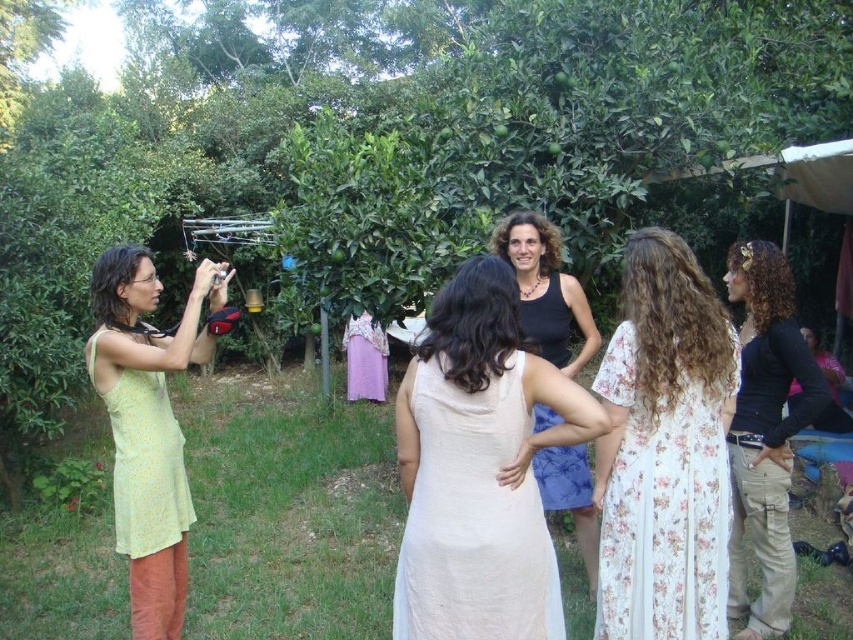
Is black matte pants at right above light beige fabric dress at center?

Yes.

What do you see at coordinates (764, 433) in the screenshot? I see `black matte pants at right` at bounding box center [764, 433].

Which is behind, point (729, 289) or point (589, 477)?

The point (589, 477) is behind.

The height and width of the screenshot is (640, 853). What are the coordinates of `black matte pants at right` in the screenshot? It's located at (764, 433).

Is white cotton dress at center shorter than yellow floral fabric dress at left?

Incorrect, white cotton dress at center's height does not fall short of yellow floral fabric dress at left's.

Which of these two, white cotton dress at center or yellow floral fabric dress at left, stands taller?

white cotton dress at center is taller.

Between point (476, 570) and point (115, 481), which one is positioned in front?

Positioned in front is point (476, 570).

Identify the location of white cotton dress at center. (473, 518).

Find the location of a particular element. Image resolution: width=853 pixels, height=640 pixels. light yellow lace dress at left is located at coordinates (148, 426).

How distant is light yellow lace dress at left from black matte tank top at center?

light yellow lace dress at left and black matte tank top at center are 1.75 meters apart.

Measure the distance between point (202, 292) and camera.

Point (202, 292) is 3.02 meters away from camera.

The image size is (853, 640). Identify the location of light yellow lace dress at left. (148, 426).